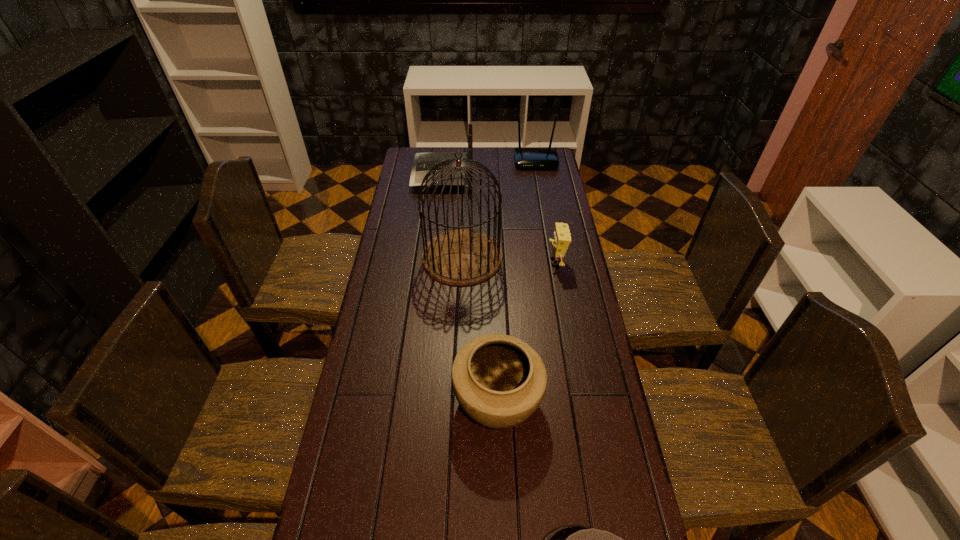
This screenshot has height=540, width=960. Identify the location of free region at the right edge of the desktop. (546, 266).

At what (x,y) coordinates should I click in order to perform the action: click on vacant area that lies between the fifth farthest object and the right router. Please return your answer as a coordinate pair (x, y). This screenshot has height=540, width=960. Looking at the image, I should click on (516, 281).

At what (x,y) coordinates should I click in order to perform the action: click on free space between the right router and the left router. Please return your answer as a coordinate pair (x, y). The width and height of the screenshot is (960, 540). Looking at the image, I should click on (490, 168).

Where is `vacant region between the birdcage and the sponge`? This screenshot has width=960, height=540. vacant region between the birdcage and the sponge is located at coordinates (509, 259).

You are a GUI agent. You are given a task and a screenshot of the screen. Output one action in this format:
    pyautogui.click(x=<x>, y=<y>)
    Task: Click on the vacant region between the right router and the left router
    The image size is (960, 540).
    Given the screenshot: What is the action you would take?
    pyautogui.click(x=490, y=168)

Image resolution: width=960 pixels, height=540 pixels. In order to click on free area in between the second nearest object and the left router in this screenshot , I will do `click(470, 287)`.

At what (x,y) coordinates should I click in order to perform the action: click on object that can be found as the third closest to the pottery. Please return your answer as a coordinate pair (x, y). Image resolution: width=960 pixels, height=540 pixels. Looking at the image, I should click on (561, 240).

At what (x,y) coordinates should I click in order to perform the action: click on object that is the fourth closest to the birdcage. Please return your answer as a coordinate pair (x, y). This screenshot has width=960, height=540. Looking at the image, I should click on (524, 157).

Image resolution: width=960 pixels, height=540 pixels. Find the location of `free space in the image that satisfies the following two spatial constraints: 1. on the front-facing side of the right router; 2. at the door of the birdcage`. free space in the image that satisfies the following two spatial constraints: 1. on the front-facing side of the right router; 2. at the door of the birdcage is located at coordinates (552, 257).

You are a GUI agent. You are given a task and a screenshot of the screen. Output one action in this format:
    pyautogui.click(x=<x>, y=<y>)
    Task: Click on the vacant position in the image that satisfies the following two spatial constraints: 1. on the front-facing side of the right router; 2. at the door of the tallest object
    The width and height of the screenshot is (960, 540).
    Given the screenshot: What is the action you would take?
    pyautogui.click(x=552, y=257)